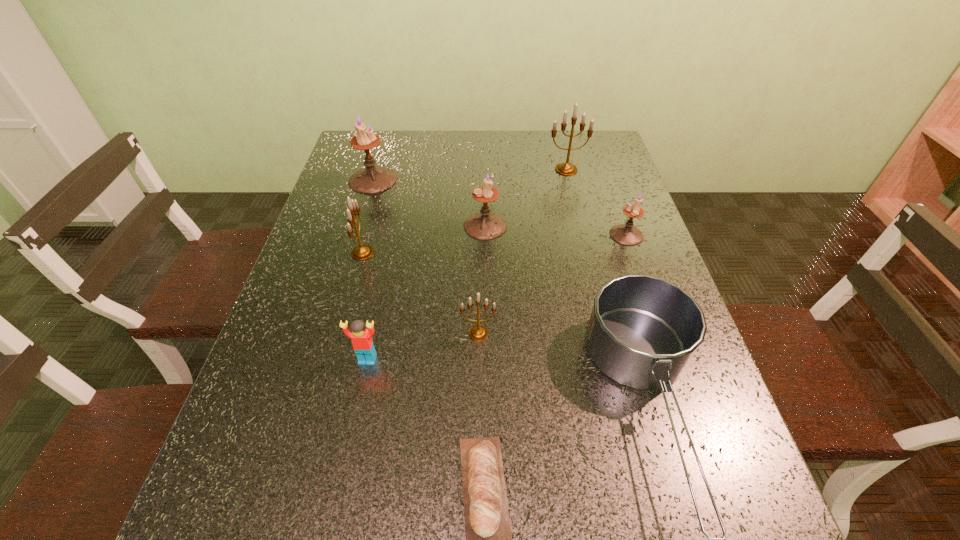
The width and height of the screenshot is (960, 540). I want to click on object at the far right corner, so click(567, 169).

In the image, there is a desktop. Where is `free space at the far edge`? This screenshot has width=960, height=540. free space at the far edge is located at coordinates (520, 163).

In the image, there is a desktop. What are the coordinates of `free region at the left edge` in the screenshot? It's located at (308, 383).

Image resolution: width=960 pixels, height=540 pixels. What are the coordinates of `free space at the right edge` in the screenshot? It's located at (642, 429).

I want to click on free region at the near right corner of the desktop, so click(x=743, y=532).

Locate an element on the screen. free spot between the biggest gold candelabrum and the farthest purple candle holder is located at coordinates (469, 175).

Locate an element on the screen. The height and width of the screenshot is (540, 960). free area in between the fifth candelabrum from left to right and the second gold candelabrum from left to right is located at coordinates (522, 252).

Identify the location of vacant point located between the nearest gold candelabrum and the leftmost purple candle holder. Image resolution: width=960 pixels, height=540 pixels. (426, 256).

Where is `free spot between the rightmost gold candelabrum and the second smallest purple candle holder`? free spot between the rightmost gold candelabrum and the second smallest purple candle holder is located at coordinates (526, 198).

At what (x,y) coordinates should I click in order to perform the action: click on object that stands as the eighth closest to the rightmost gold candelabrum. Please return your answer as a coordinate pair (x, y). The height and width of the screenshot is (540, 960). Looking at the image, I should click on (487, 525).